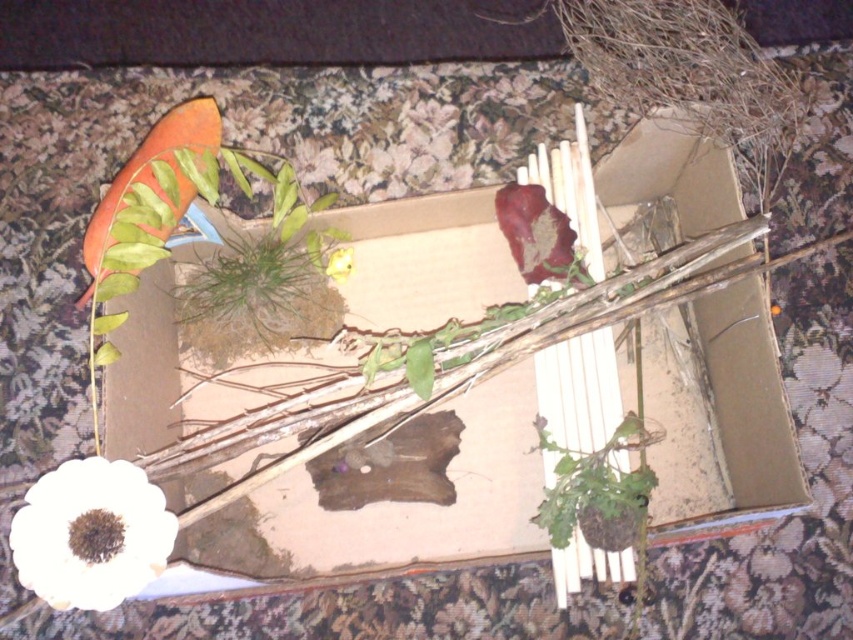
You are organizing a miniature garden inside a cardboard box on a floral carpet. You have a green matte plant at lower right and a yellow matte flower at center. Which object is positioned to the right of the other?

A: The green matte plant at lower right is positioned to the right of the yellow matte flower at center.

You are standing 30 inches away from the brown cardboard box at center. Can you reach it without moving your feet?

The distance between you and the brown cardboard box at center is 34.76 inches, which is farther than your current standing distance of 30 inches. Therefore, you cannot reach it without moving your feet.

You are standing 30 inches away from the brown cardboard box at center. Can you reach it without moving your feet?

The brown cardboard box at center is 34.76 inches away from the viewer. Since you are standing 30 inches away, you cannot reach it without moving your feet because it is farther than your current position.